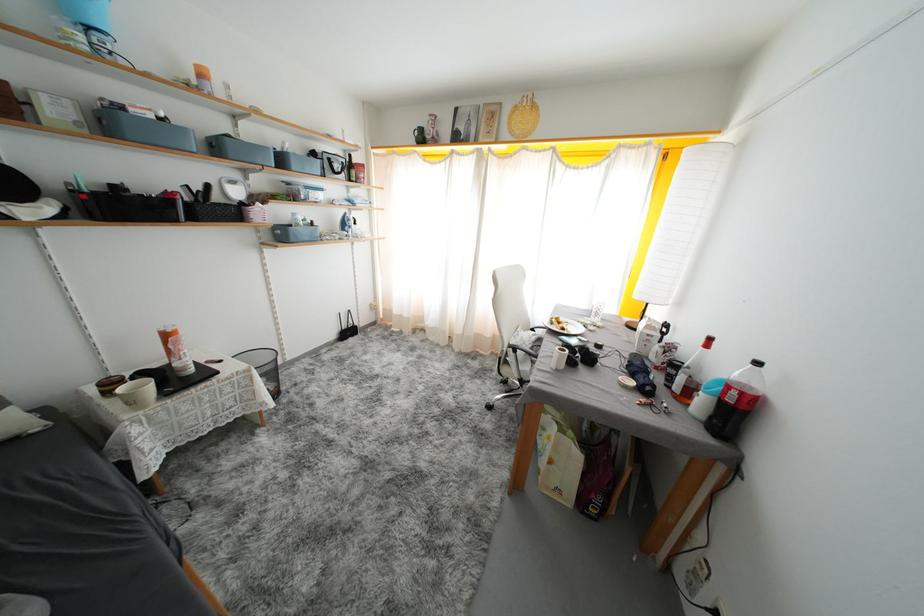
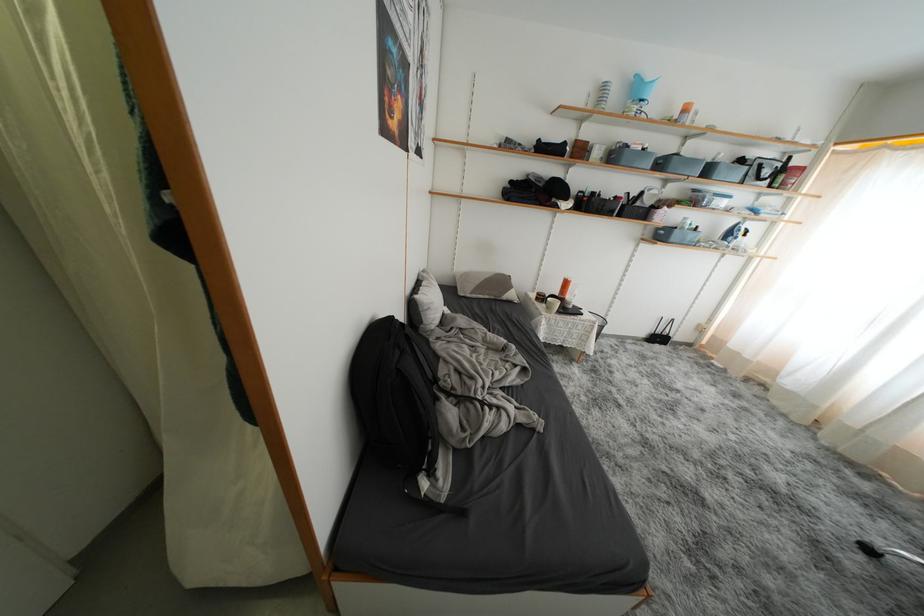
Find the pixel in the second image that matches the point at 223,151 in the first image.

(667, 168)